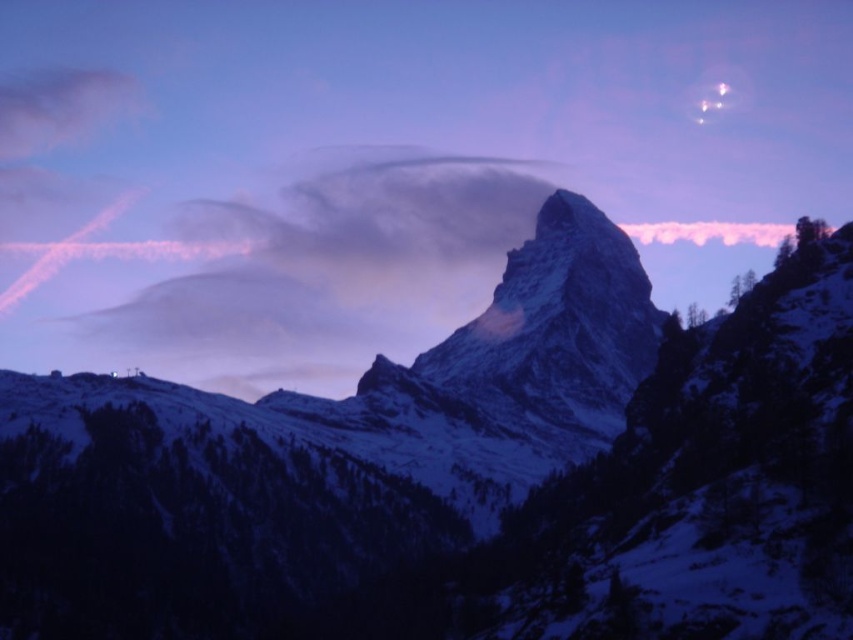
In the scene shown: Between snowy granite mountain at center and white fluffy cloud at center, which one appears on the left side from the viewer's perspective?

Positioned to the left is white fluffy cloud at center.

Does point (830, 493) come farther from viewer compared to point (91, 348)?

No, it is in front of (91, 348).

The width and height of the screenshot is (853, 640). What are the coordinates of `snowy granite mountain at center` in the screenshot? It's located at (465, 474).